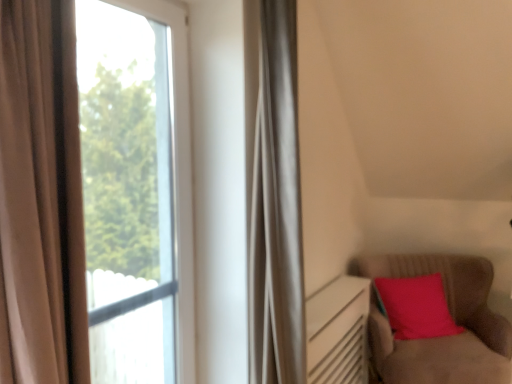
Question: Can you confirm if transparent glass window at left, which ranks as the 1th window in right-to-left order, is thinner than transparent glass window at left, arranged as the 2th window when viewed from the right?

Choices:
 (A) yes
 (B) no

Answer: (A)

Question: Does transparent glass window at left, which ranks as the 1th window in right-to-left order, have a greater height compared to transparent glass window at left, arranged as the 2th window when viewed from the right?

Choices:
 (A) no
 (B) yes

Answer: (B)

Question: Considering the relative sizes of transparent glass window at left, the 2th window in the left-to-right sequence, and transparent glass window at left, the 1th window positioned from the left, in the image provided, is transparent glass window at left, the 2th window in the left-to-right sequence, shorter than transparent glass window at left, the 1th window positioned from the left,?

Choices:
 (A) yes
 (B) no

Answer: (B)

Question: Is transparent glass window at left, the 2th window in the left-to-right sequence, turned away from transparent glass window at left, arranged as the 2th window when viewed from the right?

Choices:
 (A) no
 (B) yes

Answer: (B)

Question: Can you confirm if transparent glass window at left, the 2th window in the left-to-right sequence, is bigger than transparent glass window at left, arranged as the 2th window when viewed from the right?

Choices:
 (A) yes
 (B) no

Answer: (B)

Question: Is transparent glass window at left, which ranks as the 1th window in right-to-left order, spatially inside velvet-like brown armchair at lower right, or outside of it?

Choices:
 (A) outside
 (B) inside

Answer: (A)

Question: In terms of size, does transparent glass window at left, which ranks as the 1th window in right-to-left order, appear bigger or smaller than velvet-like brown armchair at lower right?

Choices:
 (A) small
 (B) big

Answer: (A)

Question: Relative to velvet-like brown armchair at lower right, is transparent glass window at left, the 2th window in the left-to-right sequence, in front or behind?

Choices:
 (A) front
 (B) behind

Answer: (A)

Question: Would you say transparent glass window at left, which ranks as the 1th window in right-to-left order, is to the left or to the right of velvet-like brown armchair at lower right in the picture?

Choices:
 (A) right
 (B) left

Answer: (B)

Question: From the image's perspective, is transparent glass window at left, arranged as the 2th window when viewed from the right, located above or below transparent glass window at left, the 2th window in the left-to-right sequence?

Choices:
 (A) above
 (B) below

Answer: (B)

Question: Is point (146, 276) closer or farther from the camera than point (5, 89)?

Choices:
 (A) farther
 (B) closer

Answer: (A)

Question: From a real-world perspective, is transparent glass window at left, arranged as the 2th window when viewed from the right, above or below transparent glass window at left, which ranks as the 1th window in right-to-left order?

Choices:
 (A) below
 (B) above

Answer: (A)

Question: Is transparent glass window at left, the 1th window positioned from the left, inside the boundaries of transparent glass window at left, the 2th window in the left-to-right sequence, or outside?

Choices:
 (A) inside
 (B) outside

Answer: (B)

Question: Is transparent glass window at left, the 1th window positioned from the left, wider or thinner than velvet-like brown armchair at lower right?

Choices:
 (A) thin
 (B) wide

Answer: (A)

Question: Considering the positions of transparent glass window at left, arranged as the 2th window when viewed from the right, and velvet-like brown armchair at lower right in the image, is transparent glass window at left, arranged as the 2th window when viewed from the right, bigger or smaller than velvet-like brown armchair at lower right?

Choices:
 (A) big
 (B) small

Answer: (B)